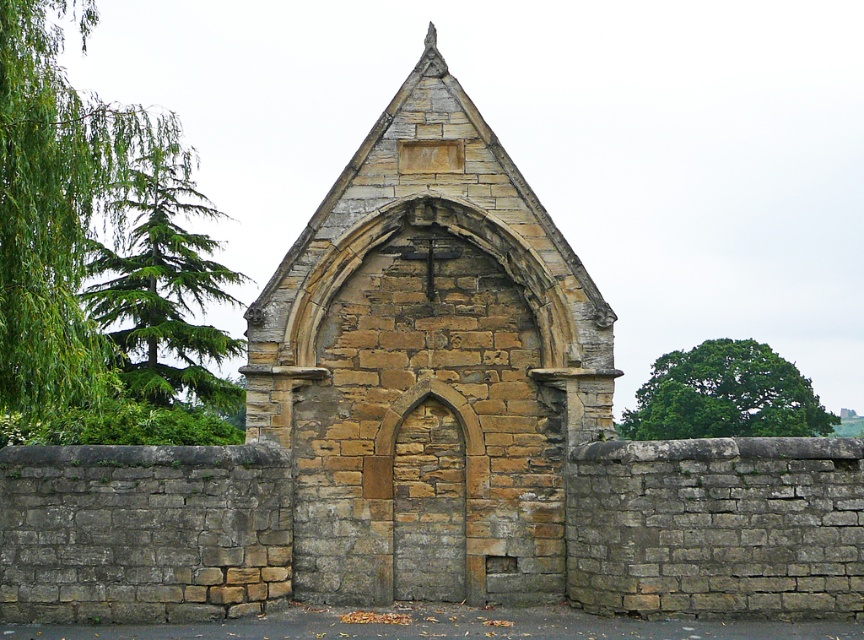
You are standing at point 0.5, 0.5 in the image. Which direction should you move to reach the yellow stone church at center?

The yellow stone church at center is located at point (429, 365). Since you are at (432, 320), you should move northeast to reach it.

You are standing in front of the yellow stone church at center and looking towards the green leafy tree at upper right. Which object appears larger in the image?

The green leafy tree at upper right appears larger than the yellow stone church at center in the image.